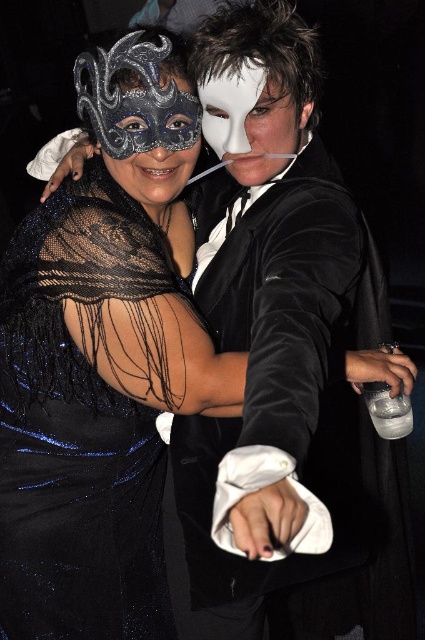
Question: Which object is the closest to the metallic mask at center?

Choices:
 (A) black sequined dress at left
 (B) white matte mask at center

Answer: (B)

Question: Is black sequined dress at left behind metallic mask at center?

Choices:
 (A) yes
 (B) no

Answer: (A)

Question: Does white matte mask at center have a greater width compared to metallic mask at center?

Choices:
 (A) yes
 (B) no

Answer: (B)

Question: Among these points, which one is nearest to the camera?

Choices:
 (A) (90, 218)
 (B) (210, 74)
 (C) (190, 90)

Answer: (B)

Question: Can you confirm if white matte mask at center is positioned below metallic mask at center?

Choices:
 (A) no
 (B) yes

Answer: (A)

Question: Considering the real-world distances, which object is farthest from the metallic mask at center?

Choices:
 (A) white matte mask at center
 (B) black sequined dress at left

Answer: (B)